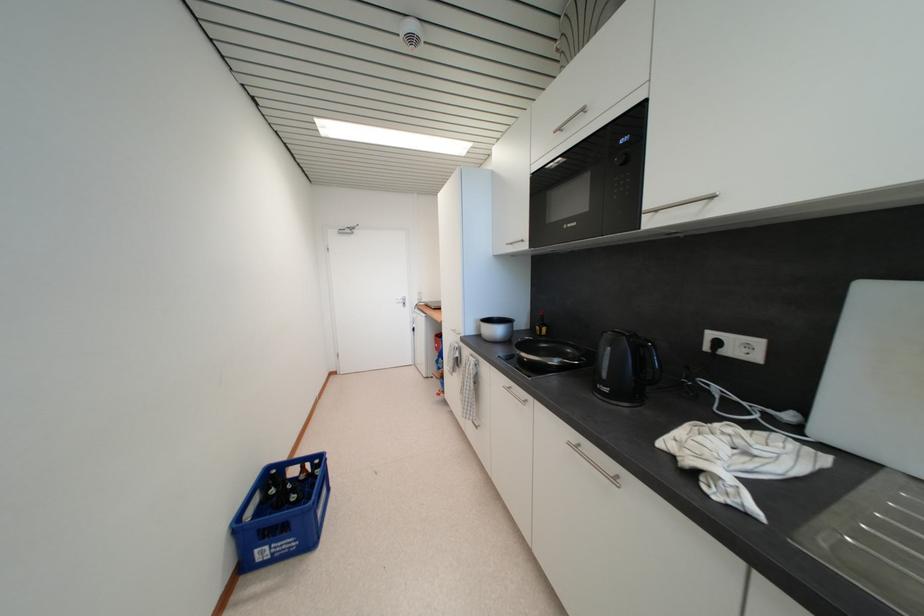
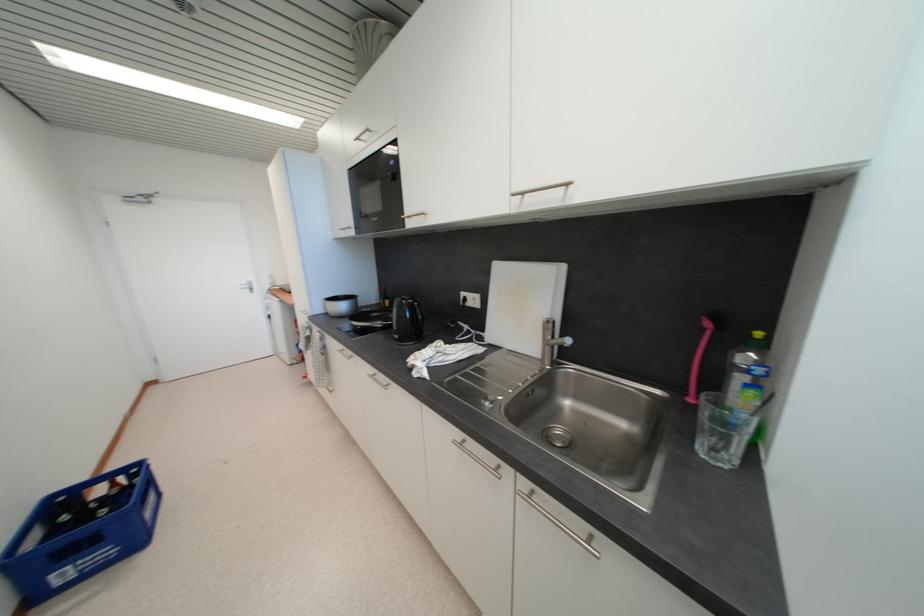
Find the pixel in the second image that matches the point at 574,446 in the first image.

(373, 378)